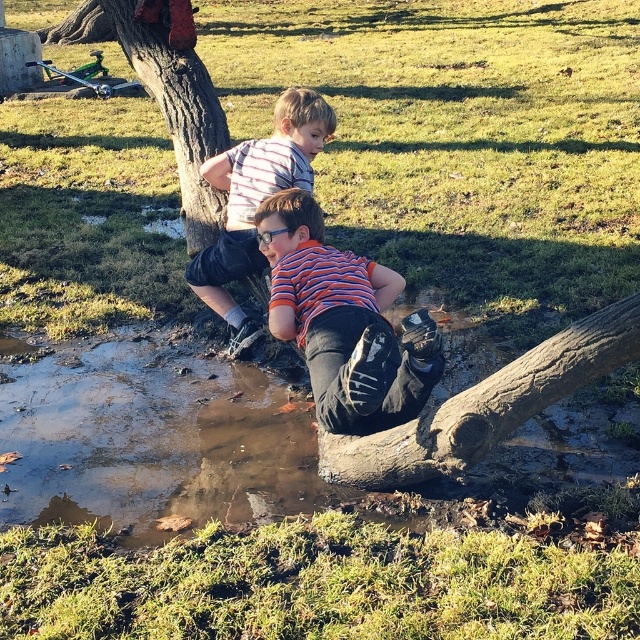
Question: Which object is the farthest from the muddy log at lower center?

Choices:
 (A) brown rough tree trunk at upper left
 (B) orange striped shirt at center
 (C) striped shirt at center

Answer: (A)

Question: Estimate the real-world distances between objects in this image. Which object is farther from the muddy log at lower center?

Choices:
 (A) brown rough tree trunk at upper left
 (B) brown rough log at lower center
 (C) striped shirt at center

Answer: (A)

Question: Is muddy log at lower center closer to the viewer compared to brown rough log at lower center?

Choices:
 (A) no
 (B) yes

Answer: (A)

Question: Does muddy log at lower center appear over striped shirt at center?

Choices:
 (A) no
 (B) yes

Answer: (A)

Question: Is muddy log at lower center above orange striped shirt at center?

Choices:
 (A) yes
 (B) no

Answer: (B)

Question: Which point is closer to the camera?

Choices:
 (A) muddy log at lower center
 (B) brown rough tree trunk at upper left

Answer: (A)